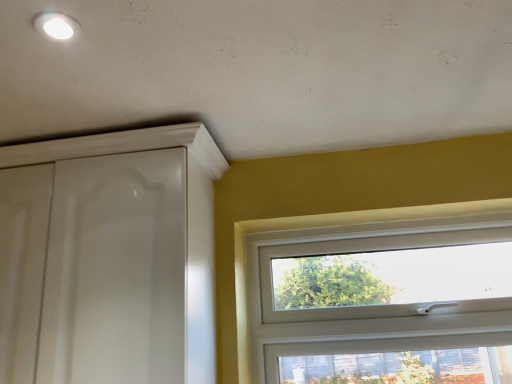
Question: Is white glossy cabinet at upper left facing away from white plastic window at center?

Choices:
 (A) no
 (B) yes

Answer: (A)

Question: From the image's perspective, would you say white glossy cabinet at upper left is shown under white plastic window at center?

Choices:
 (A) yes
 (B) no

Answer: (B)

Question: Is white glossy cabinet at upper left behind white plastic window at center?

Choices:
 (A) no
 (B) yes

Answer: (A)

Question: Is white glossy cabinet at upper left at the left side of white plastic window at center?

Choices:
 (A) yes
 (B) no

Answer: (A)

Question: Is white glossy cabinet at upper left thinner than white plastic window at center?

Choices:
 (A) no
 (B) yes

Answer: (A)

Question: From a real-world perspective, is white glossy cabinet at upper left positioned under white plastic window at center based on gravity?

Choices:
 (A) yes
 (B) no

Answer: (B)

Question: Is there a large distance between white plastic window at center and white glossy cabinet at upper left?

Choices:
 (A) no
 (B) yes

Answer: (A)

Question: Is white plastic window at center turned away from white glossy cabinet at upper left?

Choices:
 (A) yes
 (B) no

Answer: (B)

Question: From the image's perspective, is white plastic window at center located above white glossy cabinet at upper left?

Choices:
 (A) yes
 (B) no

Answer: (B)

Question: Is white plastic window at center positioned behind white glossy cabinet at upper left?

Choices:
 (A) no
 (B) yes

Answer: (B)

Question: Can you confirm if white plastic window at center is shorter than white glossy cabinet at upper left?

Choices:
 (A) no
 (B) yes

Answer: (B)

Question: Is white plastic window at center wider than white glossy cabinet at upper left?

Choices:
 (A) no
 (B) yes

Answer: (A)

Question: From their relative heights in the image, would you say white plastic window at center is taller or shorter than white glossy cabinet at upper left?

Choices:
 (A) tall
 (B) short

Answer: (B)